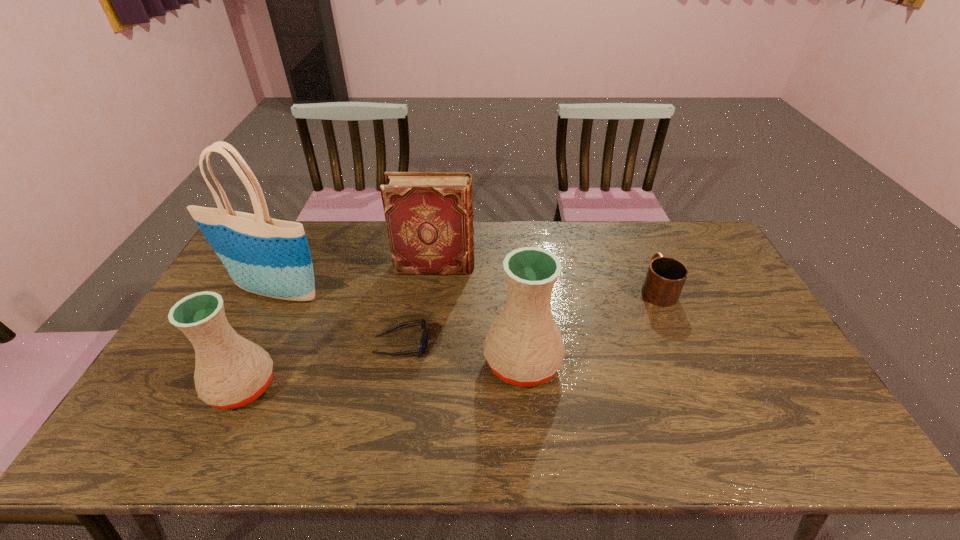
The height and width of the screenshot is (540, 960). Find the location of `free space for a new pottery on the right`. free space for a new pottery on the right is located at coordinates (778, 340).